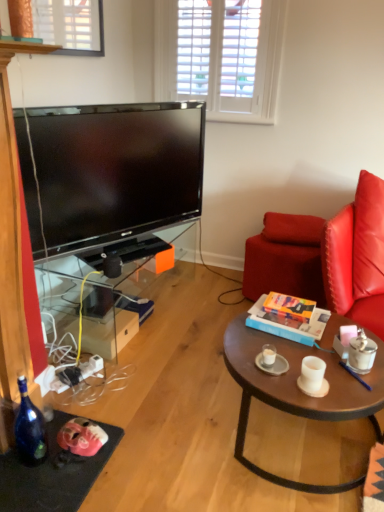
I want to click on space that is in front of metallic silver coffee cup at right, which ranks as the 1th coffee cup in right-to-left order, so click(362, 389).